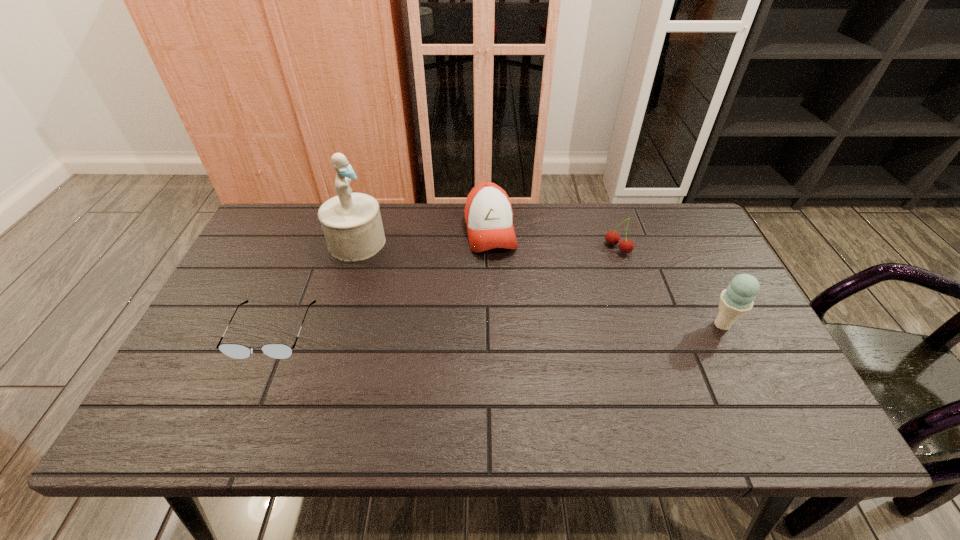
Locate an element on the screen. The height and width of the screenshot is (540, 960). object at the left edge is located at coordinates (237, 351).

You are a GUI agent. You are given a task and a screenshot of the screen. Output one action in this format:
    pyautogui.click(x=<x>, y=<y>)
    Task: Click on the object that is at the right edge
    
    Given the screenshot: What is the action you would take?
    pyautogui.click(x=738, y=299)

Find the location of a particular element. free location at the far edge of the desktop is located at coordinates (443, 229).

In the image, there is a desktop. Identify the location of free space at the near edge. This screenshot has width=960, height=540. (516, 396).

Image resolution: width=960 pixels, height=540 pixels. In the image, there is a desktop. Identify the location of vacant space at the left edge. (273, 295).

Image resolution: width=960 pixels, height=540 pixels. In the image, there is a desktop. What are the coordinates of `vacant space at the right edge` in the screenshot? It's located at (729, 331).

Locate an element on the screen. This screenshot has width=960, height=540. vacant space at the far left corner of the desktop is located at coordinates [x=260, y=251].

Locate an element on the screen. vacant position at the far right corner of the desktop is located at coordinates (657, 217).

Identify the location of vacant point located between the second tallest object and the figurine. Image resolution: width=960 pixels, height=540 pixels. (540, 284).

Locate an element on the screen. This screenshot has width=960, height=540. vacant area that lies between the tallest object and the baseball cap is located at coordinates (423, 237).